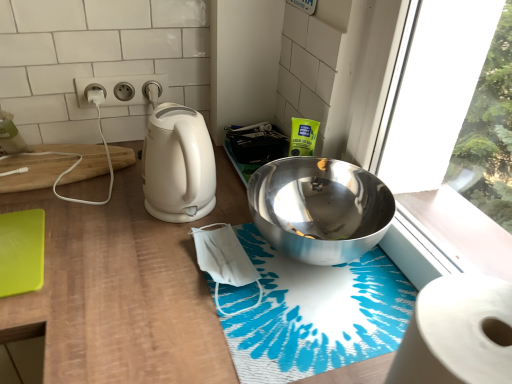
What are the coordinates of `free point below silver metallic bowl at upper right (from a real-world perspective)` in the screenshot? It's located at (308, 235).